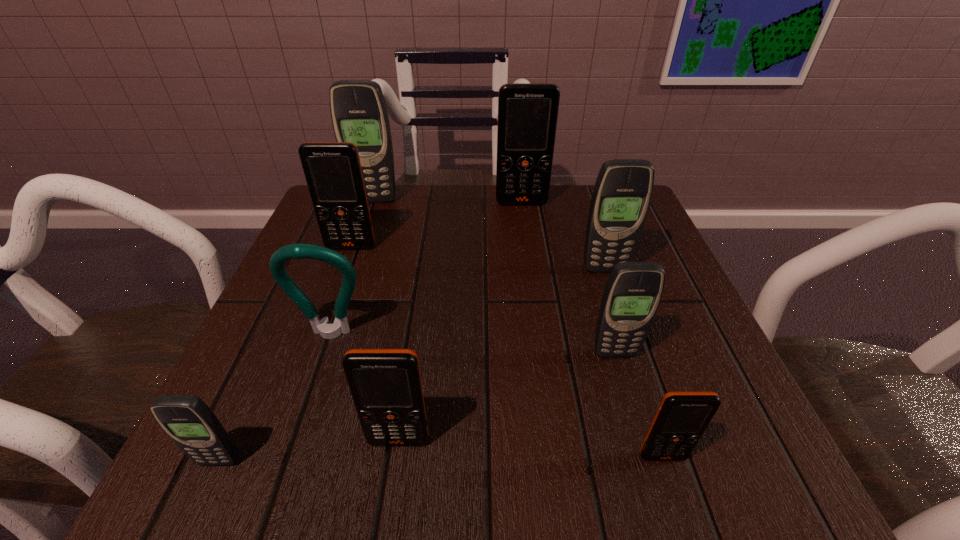
Image resolution: width=960 pixels, height=540 pixels. I want to click on vacant area located at the jaws of the green bottle opener, so click(291, 454).

Image resolution: width=960 pixels, height=540 pixels. In order to click on free region located 0.070m on the screen of the second smallest gray cellular telephone in this screenshot , I will do `click(628, 397)`.

What are the coordinates of `vacant area located 0.050m on the screen of the second nearest orange cellular telephone` in the screenshot? It's located at (392, 487).

Where is `bottle opener situated at the left edge`? bottle opener situated at the left edge is located at coordinates tap(293, 251).

The width and height of the screenshot is (960, 540). Find the location of `object that is at the near left corner`. object that is at the near left corner is located at coordinates [187, 420].

The height and width of the screenshot is (540, 960). What are the coordinates of `object that is at the near right corner` in the screenshot? It's located at pyautogui.click(x=682, y=417).

In the image, there is a desktop. Where is `vacant space at the far edge`? This screenshot has width=960, height=540. vacant space at the far edge is located at coordinates (564, 227).

Locate an element on the screen. Image resolution: width=960 pixels, height=540 pixels. vacant area at the near edge of the desktop is located at coordinates (548, 450).

This screenshot has width=960, height=540. What are the coordinates of `vacant space at the left edge of the desktop` in the screenshot? It's located at (258, 335).

Where is `free space at the right edge of the desktop`? free space at the right edge of the desktop is located at coordinates (655, 343).